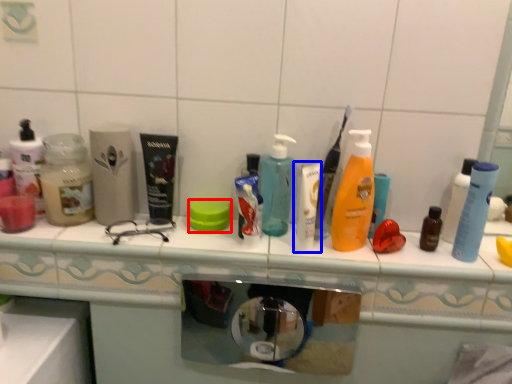
Question: Among these objects, which one is nearest to the camera, soap (highlighted by a red box) or toiletry (highlighted by a blue box)?

Choices:
 (A) soap
 (B) toiletry

Answer: (B)